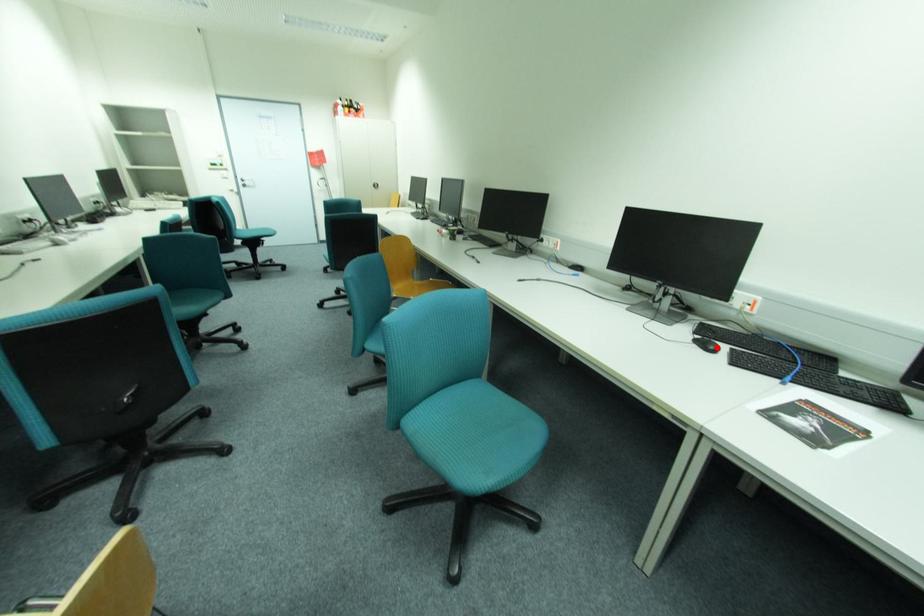
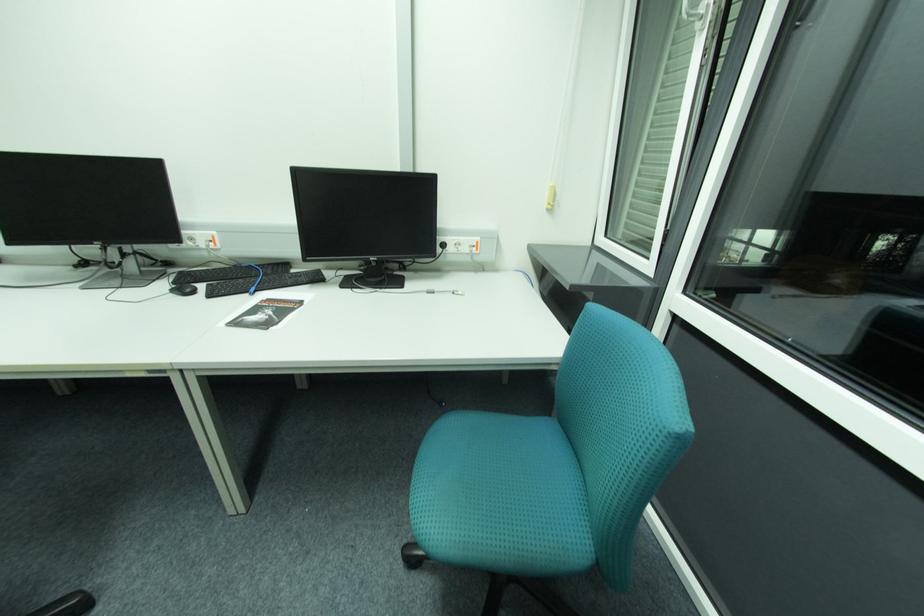
Locate, in the second image, the point that corresponds to the highlighted location in the first image.

(195, 291)